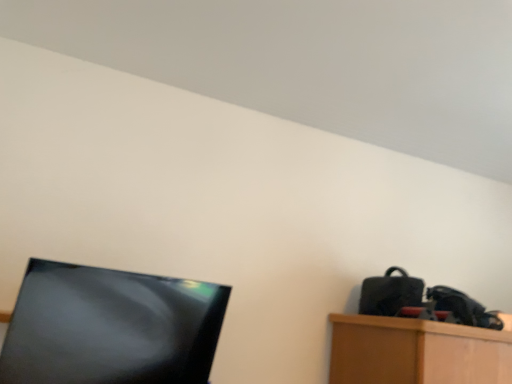
Locate an element on the screen. matte black bag at right is located at coordinates (390, 293).

The height and width of the screenshot is (384, 512). What do you see at coordinates (390, 293) in the screenshot?
I see `matte black bag at right` at bounding box center [390, 293].

Measure the distance between point (362,295) and camera.

The distance of point (362,295) from camera is 2.04 meters.

Find the location of a particular element. matte black bag at right is located at coordinates (390, 293).